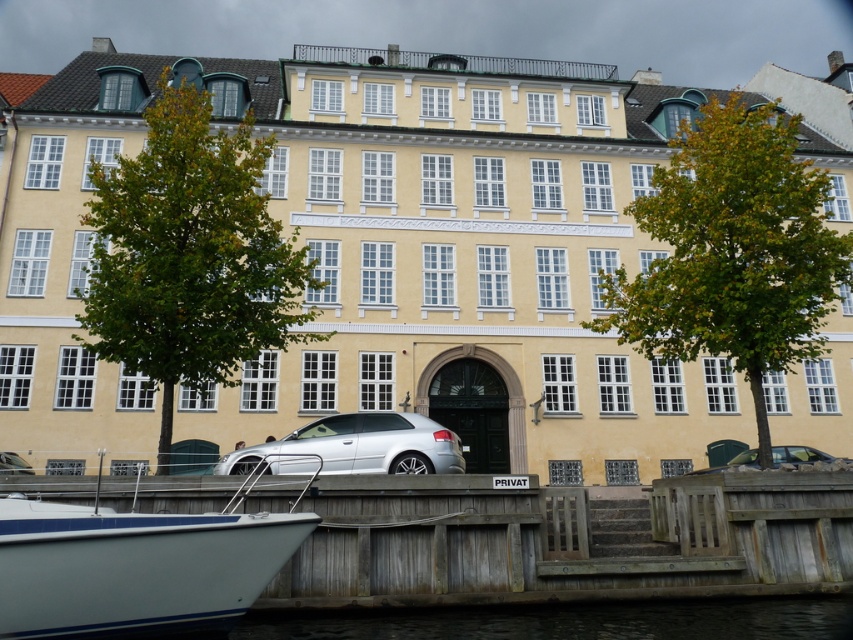
You are planning to host a small gathering on the wooden dock at lower center and the silver metallic car at lower center. Which location can accommodate more guests due to its size?

The wooden dock at lower center has a larger size compared to the silver metallic car at lower center, so it can accommodate more guests.